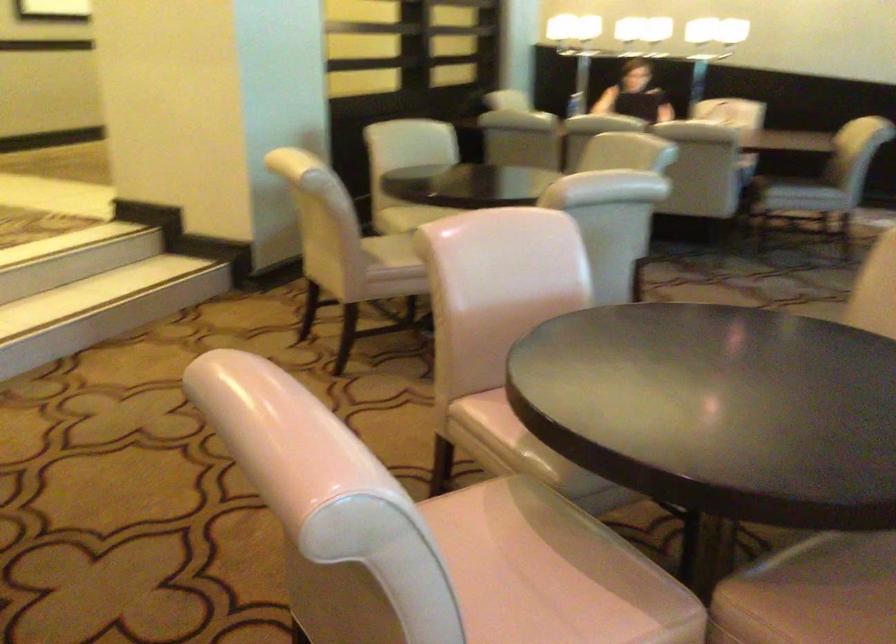
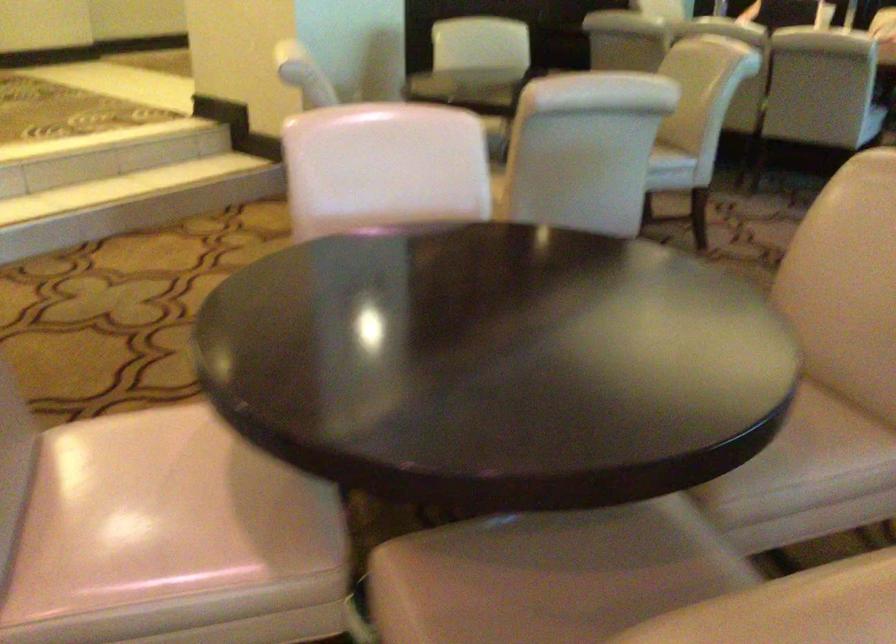
Find the pixel in the second image that matches (461,561) in the first image.

(135, 476)